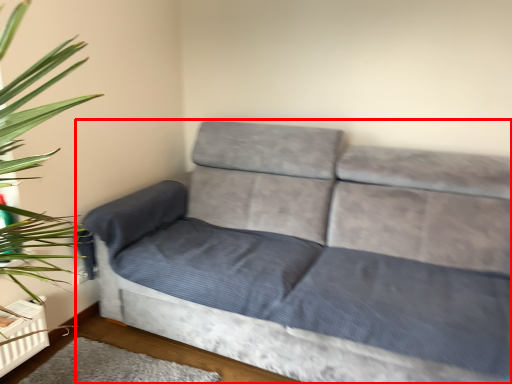
Question: From the image's perspective, what is the correct spatial positioning of studio couch (annotated by the red box) in reference to mat?

Choices:
 (A) below
 (B) above

Answer: (B)